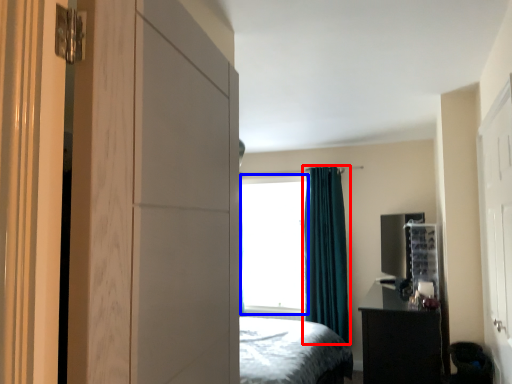
Question: Which object appears closest to the camera in this image, curtain (highlighted by a red box) or window screen (highlighted by a blue box)?

Choices:
 (A) curtain
 (B) window screen

Answer: (A)